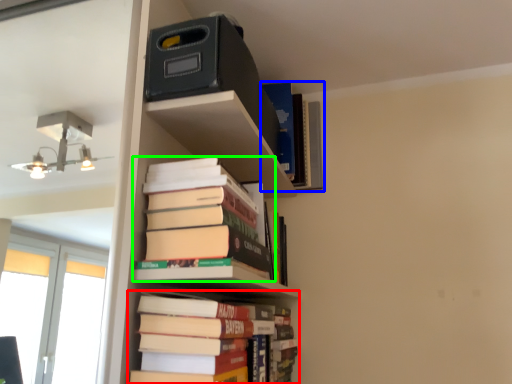
Question: Based on their relative distances, which object is farther from book (highlighted by a red box)? Choose from book (highlighted by a blue box) and book (highlighted by a green box).

Choices:
 (A) book
 (B) book

Answer: (A)